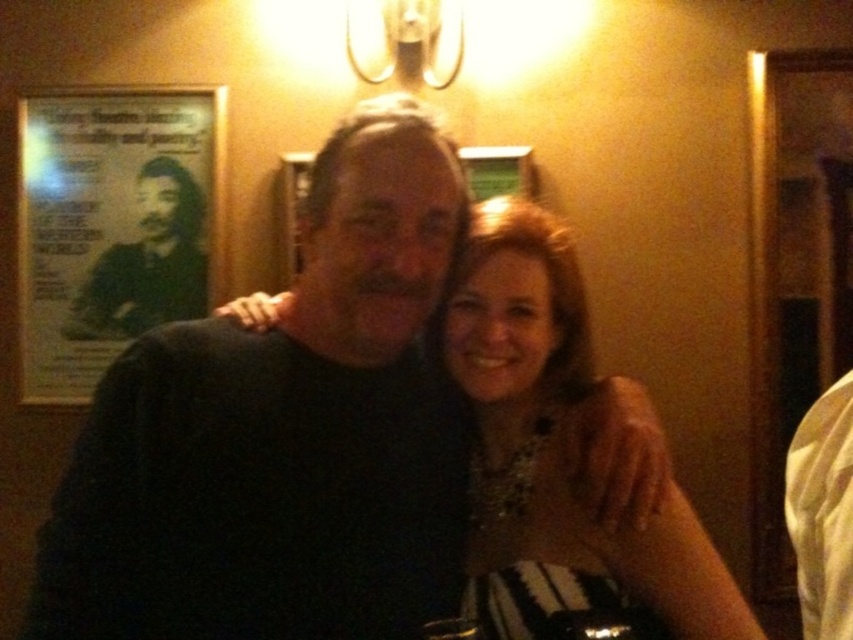
Question: Which of the following is the farthest from the observer?

Choices:
 (A) (173, 240)
 (B) (393, 596)
 (C) (548, 476)

Answer: (A)

Question: Is black matte shirt at center below shiny silver necklace at center?

Choices:
 (A) yes
 (B) no

Answer: (B)

Question: Which point appears closest to the camera in this image?

Choices:
 (A) (169, 301)
 (B) (521, 332)
 (C) (177, 401)

Answer: (C)

Question: Which object is farther from the camera taking this photo?

Choices:
 (A) shiny silver necklace at center
 (B) black matte shirt at center
 (C) green matte poster at upper left

Answer: (C)

Question: Can you confirm if black matte shirt at center is positioned below green matte poster at upper left?

Choices:
 (A) no
 (B) yes

Answer: (B)

Question: Does shiny silver necklace at center have a lesser width compared to green matte poster at upper left?

Choices:
 (A) no
 (B) yes

Answer: (B)